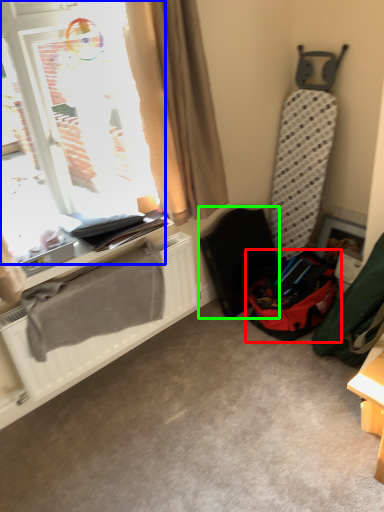
Question: Which object is the closest to the luggage and bags (highlighted by a red box)? Choose among these: window (highlighted by a blue box) or folding chair (highlighted by a green box).

Choices:
 (A) window
 (B) folding chair

Answer: (B)